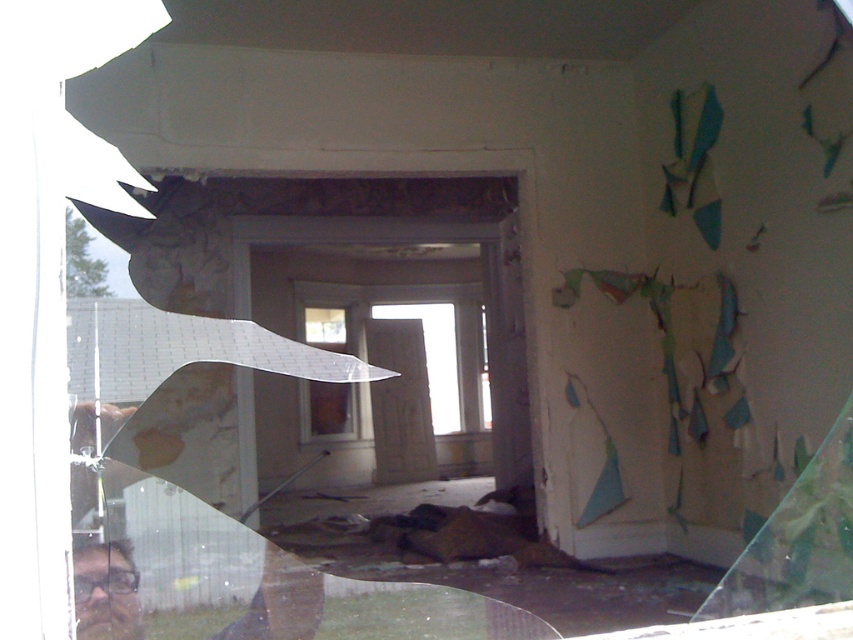
You are a contractor measuring the space between two windows in a house. You need to install a 2 meter long decorative beam between the clear glass window at center and the transparent glass window at center. Will the beam fit between them?

The clear glass window at center is 1.97 meters from transparent glass window at center. The beam is 2 meters long, which is slightly longer than the distance between the windows. Therefore, the beam will not fit between them.

You are a contractor assessing the house for repairs. You notice two windows in the scene, the clear glass window at center and the transparent glass window at center. Which window has a greater width?

The clear glass window at center might be wider than transparent glass window at center according to the description provided.

You are standing in the disheveled house and see the point marked at coordinates (329, 408). What object is located at that point?

The clear glass window at center is located at the point marked at coordinates (329, 408).